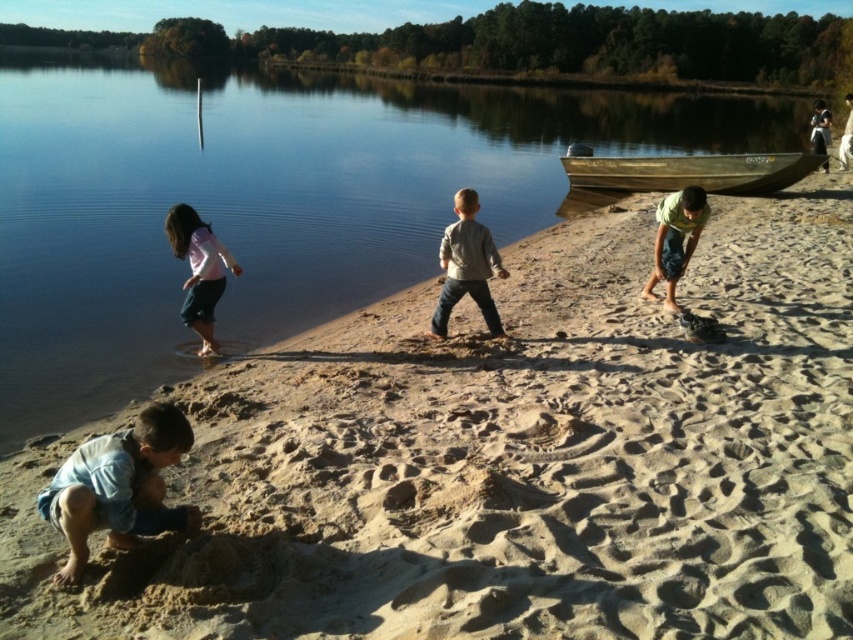
Looking at this image, who is more distant from viewer, [697,106] or [167,416]?

Point [697,106]

Which of these two, clear water at shore left or light blue denim shorts at lower left, stands taller?

clear water at shore left

Does point (500, 168) come behind point (171, 424)?

Yes, point (500, 168) is farther from viewer.

This screenshot has height=640, width=853. I want to click on clear water at shore left, so click(x=271, y=200).

Does dark blue jeans at lower right have a lesser width compared to light brown wooden pole at upper center?

No.

Does dark blue jeans at lower right have a greater width compared to light brown wooden pole at upper center?

Yes.

Locate an element on the screen. Image resolution: width=853 pixels, height=640 pixels. dark blue jeans at lower right is located at coordinates (820, 131).

Which is more to the right, light gray denim jeans at center or matte pink shirt at left?

light gray denim jeans at center is more to the right.

Between point (462, 198) and point (186, 292), which one is positioned behind?

The point (186, 292) is behind.

Measure the distance between point (486,321) and camera.

The distance of point (486,321) from camera is 7.04 meters.

Where is `light gray denim jeans at center`? light gray denim jeans at center is located at coordinates (466, 266).